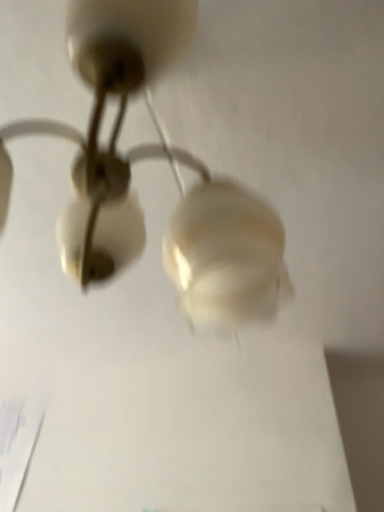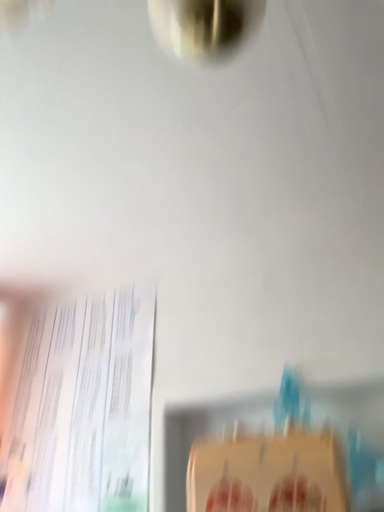
Question: Which way did the camera rotate in the video?

Choices:
 (A) rotated right
 (B) rotated left

Answer: (B)